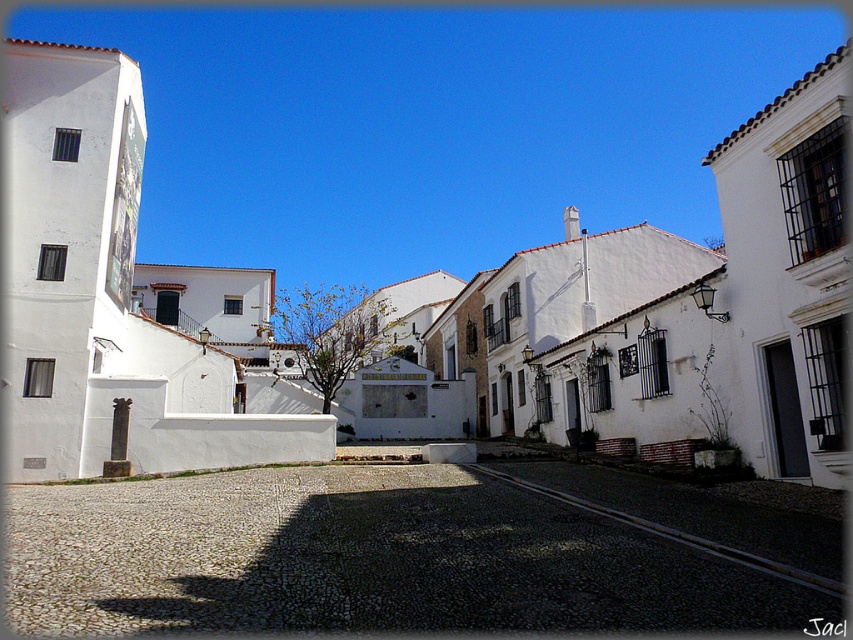
You are standing at the entrance of the gray cobblestone alley at center and want to walk towards the white matte building at center. Which direction should you face to move towards it?

Since the gray cobblestone alley at center is closer to the viewer than the white matte building at center, you should face forward along the alley to move towards the building.

You are a tour guide leading a group through the Mediterranean town. You want to ensure everyone can walk comfortably through the gray cobblestone alley at center. If the average width of a person is 0.5 meters, how many people can walk side by side in the alley?

The gray cobblestone alley at center is 4.92 meters wide. Dividing this by the average person width of 0.5 meters gives 9.84, so approximately 9 people can walk side by side.